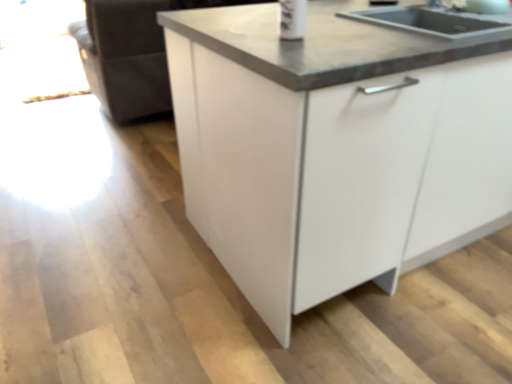
What do you see at coordinates (336, 147) in the screenshot? I see `white glossy cabinet at center` at bounding box center [336, 147].

Locate an element on the screen. The height and width of the screenshot is (384, 512). white glossy cabinet at center is located at coordinates (336, 147).

In order to face white glossy cabinet at center, should I rotate leftwards or rightwards?

Turn right approximately 23.658 degrees to face it.

Describe the element at coordinates (332, 42) in the screenshot. This screenshot has height=384, width=512. I see `black granite sink at upper right` at that location.

Measure the distance between black granite sink at upper right and camera.

34.89 inches.

Find the location of a particular element. black granite sink at upper right is located at coordinates (332, 42).

Where is `white glossy cabinet at center`? The image size is (512, 384). white glossy cabinet at center is located at coordinates (336, 147).

Which is more to the left, white glossy cabinet at center or black granite sink at upper right?

Positioned to the left is black granite sink at upper right.

From the picture: Who is more distant, white glossy cabinet at center or black granite sink at upper right?

black granite sink at upper right is behind.

Is point (413, 70) farther from camera compared to point (312, 88)?

Yes, point (413, 70) is behind point (312, 88).

From the image's perspective, is white glossy cabinet at center below black granite sink at upper right?

Correct, white glossy cabinet at center appears lower than black granite sink at upper right in the image.

From a real-world perspective, does white glossy cabinet at center sit lower than black granite sink at upper right?

Yes, from a real-world perspective, white glossy cabinet at center is under black granite sink at upper right.

Considering the relative sizes of white glossy cabinet at center and black granite sink at upper right in the image provided, is white glossy cabinet at center thinner than black granite sink at upper right?

Incorrect, the width of white glossy cabinet at center is not less than that of black granite sink at upper right.

From their relative heights in the image, would you say white glossy cabinet at center is taller or shorter than black granite sink at upper right?

Considering their sizes, white glossy cabinet at center has more height than black granite sink at upper right.

In terms of size, does white glossy cabinet at center appear bigger or smaller than black granite sink at upper right?

Clearly, white glossy cabinet at center is larger in size than black granite sink at upper right.

Would you say black granite sink at upper right is part of white glossy cabinet at center's contents?

Yes.

Is white glossy cabinet at center next to black granite sink at upper right and touching it?

They are not placed beside each other.

Is black granite sink at upper right at the back of white glossy cabinet at center?

That's not correct — white glossy cabinet at center is not looking away from black granite sink at upper right.

How many degrees apart are the facing directions of white glossy cabinet at center and black granite sink at upper right?

0.000143 degrees separate the facing orientations of white glossy cabinet at center and black granite sink at upper right.

Measure the distance between white glossy cabinet at center and black granite sink at upper right.

9.96 inches.

Locate an element on the screen. The height and width of the screenshot is (384, 512). countertop above the white glossy cabinet at center (from the image's perspective) is located at coordinates (332, 42).

Based on their positions, is black granite sink at upper right located to the left or right of white glossy cabinet at center?

black granite sink at upper right is positioned on white glossy cabinet at center's left side.

Is the depth of black granite sink at upper right less than that of white glossy cabinet at center?

No, black granite sink at upper right is further to the viewer.

Is point (312, 55) positioned before point (188, 160)?

That is True.

Based on the photo, from the image's perspective, is black granite sink at upper right located above or below white glossy cabinet at center?

black granite sink at upper right is situated higher than white glossy cabinet at center in the image.

From a real-world perspective, is black granite sink at upper right beneath white glossy cabinet at center?

No, from a real-world perspective, black granite sink at upper right is not under white glossy cabinet at center.

Between black granite sink at upper right and white glossy cabinet at center, which one has larger width?

white glossy cabinet at center is wider.

Considering the relative sizes of black granite sink at upper right and white glossy cabinet at center in the image provided, is black granite sink at upper right taller than white glossy cabinet at center?

Incorrect, the height of black granite sink at upper right is not larger of that of white glossy cabinet at center.

Considering the relative sizes of black granite sink at upper right and white glossy cabinet at center in the image provided, is black granite sink at upper right smaller than white glossy cabinet at center?

Indeed, black granite sink at upper right has a smaller size compared to white glossy cabinet at center.

Is black granite sink at upper right not inside white glossy cabinet at center?

No, black granite sink at upper right is inside white glossy cabinet at center's boundary.

Are black granite sink at upper right and white glossy cabinet at center far apart?

That's not correct — black granite sink at upper right is a little close to white glossy cabinet at center.

Could you tell me if black granite sink at upper right is turned towards white glossy cabinet at center?

Yes, black granite sink at upper right is oriented towards white glossy cabinet at center.

What's the angular difference between black granite sink at upper right and white glossy cabinet at center's facing directions?

black granite sink at upper right and white glossy cabinet at center are facing 0.000143 degrees away from each other.

How much distance is there between black granite sink at upper right and white glossy cabinet at center?

9.96 inches.

Locate an element on the screen. This screenshot has width=512, height=384. cabinetry in front of the black granite sink at upper right is located at coordinates (336, 147).

The height and width of the screenshot is (384, 512). I want to click on cabinetry in front of the black granite sink at upper right, so click(x=336, y=147).

In the image, there is a black granite sink at upper right. Where is `cabinetry below it (from a real-world perspective)`? Image resolution: width=512 pixels, height=384 pixels. cabinetry below it (from a real-world perspective) is located at coordinates (336, 147).